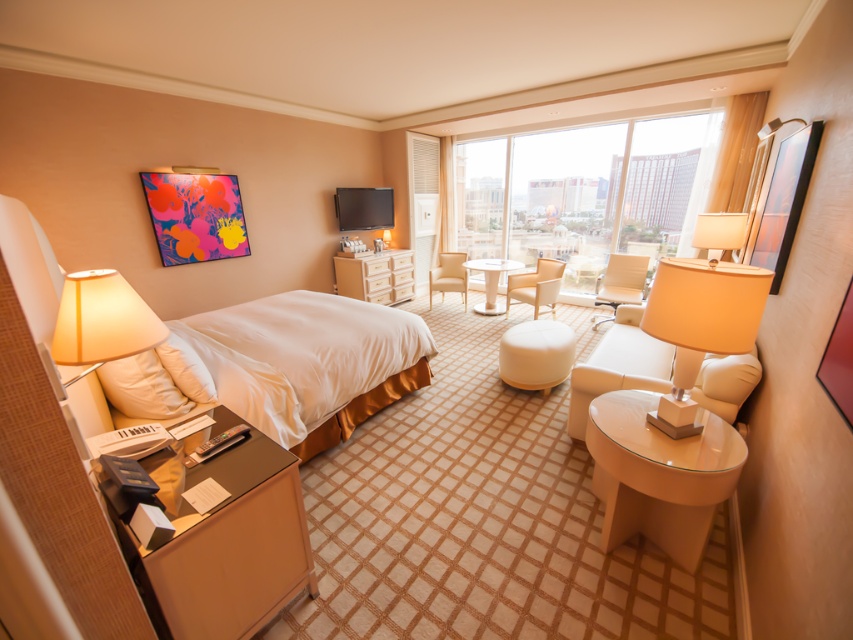
Who is higher up, white leather armchair at right or light brown leather armchair at center?

light brown leather armchair at center is above.

Which of these two, white leather armchair at right or light brown leather armchair at center, stands taller?

white leather armchair at right is taller.

Is point (606, 339) farther from camera compared to point (622, 280)?

No.

Where is `white leather armchair at right`? white leather armchair at right is located at coordinates (619, 365).

Is black glossy nightstand at lower left to the right of light brown leather armchair at center from the viewer's perspective?

In fact, black glossy nightstand at lower left is to the left of light brown leather armchair at center.

Is point (236, 468) more distant than point (602, 294)?

No, (236, 468) is closer to viewer.

Does point (288, 577) come farther from viewer compared to point (593, 326)?

No, (288, 577) is closer to viewer.

At what (x,y) coordinates should I click in order to perform the action: click on black glossy nightstand at lower left. Please return your answer as a coordinate pair (x, y). The height and width of the screenshot is (640, 853). Looking at the image, I should click on (229, 548).

Who is more forward, (515, 356) or (485, 292)?

Point (515, 356) is in front.

Who is taller, white fabric stool at center or white glossy table at center?

white glossy table at center is taller.

Is point (564, 356) less distant than point (495, 275)?

Yes, point (564, 356) is in front of point (495, 275).

What are the coordinates of `white fabric stool at center` in the screenshot? It's located at (537, 355).